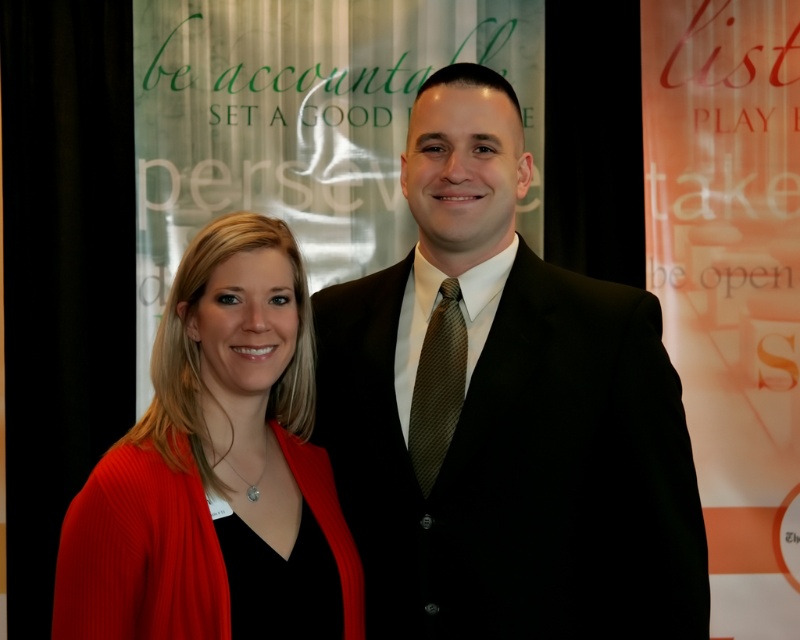
In the scene shown: You are standing in front of the image and want to locate the black suit at center. According to the coordinates provided, where exactly is it positioned?

The black suit at center is located at coordinates point (504, 412).

You are organizing a charity event and need to decide which item to display first in a showcase. The items are the knitted red cardigan at left and the brown textured tie at center. Based on their sizes, which item should you place first to make the showcase more visually appealing?

The knitted red cardigan at left is bigger than the brown textured tie at center, so placing the knitted red cardigan at left first will create a more visually appealing showcase due to its larger size.